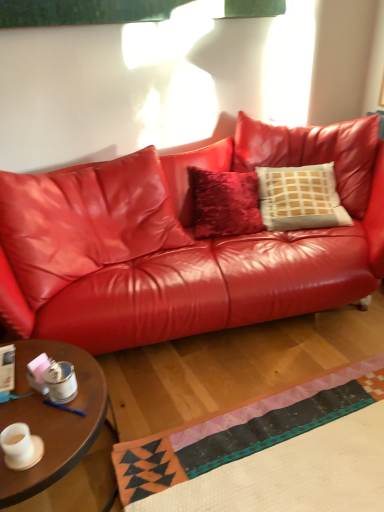
Question: Does white textured pillow at center have a larger size compared to wooden round table at lower left?

Choices:
 (A) no
 (B) yes

Answer: (B)

Question: Can you confirm if white textured pillow at center is positioned to the left of wooden round table at lower left?

Choices:
 (A) no
 (B) yes

Answer: (A)

Question: Would you consider white textured pillow at center to be distant from wooden round table at lower left?

Choices:
 (A) no
 (B) yes

Answer: (B)

Question: Is the surface of white textured pillow at center in direct contact with wooden round table at lower left?

Choices:
 (A) no
 (B) yes

Answer: (A)

Question: From the image's perspective, is white textured pillow at center below wooden round table at lower left?

Choices:
 (A) no
 (B) yes

Answer: (A)

Question: Does white textured pillow at center have a lesser width compared to wooden round table at lower left?

Choices:
 (A) no
 (B) yes

Answer: (B)

Question: Is glossy leather couch at center not within wooden round table at lower left?

Choices:
 (A) no
 (B) yes

Answer: (B)

Question: From a real-world perspective, is glossy leather couch at center positioned over wooden round table at lower left based on gravity?

Choices:
 (A) yes
 (B) no

Answer: (A)

Question: Is glossy leather couch at center to the left of wooden round table at lower left from the viewer's perspective?

Choices:
 (A) yes
 (B) no

Answer: (B)

Question: Are glossy leather couch at center and wooden round table at lower left located far from each other?

Choices:
 (A) yes
 (B) no

Answer: (B)

Question: From the image's perspective, is glossy leather couch at center located above wooden round table at lower left?

Choices:
 (A) yes
 (B) no

Answer: (A)

Question: Can wooden round table at lower left be found inside glossy leather couch at center?

Choices:
 (A) no
 (B) yes

Answer: (A)

Question: Is there a large distance between wooden round table at lower left and matte white cup at lower left?

Choices:
 (A) no
 (B) yes

Answer: (A)